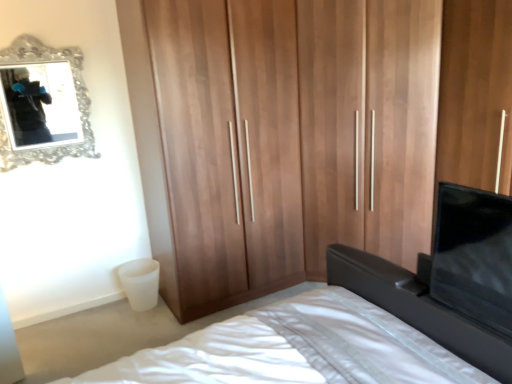
Question: Is matte black vanity at lower right at the right side of white fabric bed at center?

Choices:
 (A) no
 (B) yes

Answer: (B)

Question: From a real-world perspective, is matte black vanity at lower right positioned over white fabric bed at center based on gravity?

Choices:
 (A) yes
 (B) no

Answer: (B)

Question: Is matte black vanity at lower right oriented away from white fabric bed at center?

Choices:
 (A) yes
 (B) no

Answer: (A)

Question: Is matte black vanity at lower right touching white fabric bed at center?

Choices:
 (A) yes
 (B) no

Answer: (A)

Question: Is matte black vanity at lower right closer to the viewer compared to white fabric bed at center?

Choices:
 (A) yes
 (B) no

Answer: (B)

Question: Can you confirm if matte black vanity at lower right is shorter than white fabric bed at center?

Choices:
 (A) no
 (B) yes

Answer: (B)

Question: Can you see white fabric bed at center touching matte black vanity at lower right?

Choices:
 (A) yes
 (B) no

Answer: (A)

Question: Does white fabric bed at center lie behind matte black vanity at lower right?

Choices:
 (A) yes
 (B) no

Answer: (B)

Question: Does white fabric bed at center have a greater width compared to matte black vanity at lower right?

Choices:
 (A) no
 (B) yes

Answer: (B)

Question: Is white fabric bed at center at the left side of matte black vanity at lower right?

Choices:
 (A) yes
 (B) no

Answer: (A)

Question: Considering the relative sizes of white fabric bed at center and matte black vanity at lower right in the image provided, is white fabric bed at center taller than matte black vanity at lower right?

Choices:
 (A) no
 (B) yes

Answer: (B)

Question: Can you confirm if white fabric bed at center is positioned to the right of matte black vanity at lower right?

Choices:
 (A) no
 (B) yes

Answer: (A)

Question: Is wooden wardrobe at center facing away from matte black vanity at lower right?

Choices:
 (A) yes
 (B) no

Answer: (B)